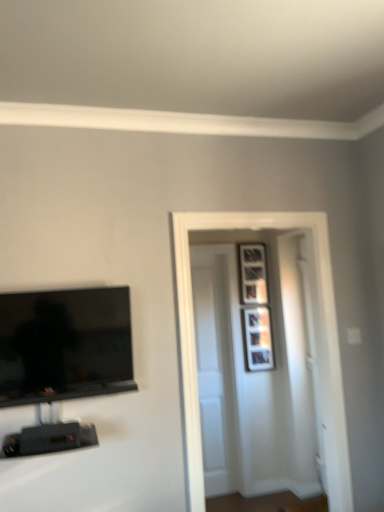
Question: Is black glossy tv at left further to the viewer compared to wooden picture frame at upper right, placed as the first picture frame when sorted from top to bottom?

Choices:
 (A) yes
 (B) no

Answer: (B)

Question: Does black glossy tv at left contain wooden picture frame at upper right, placed as the first picture frame when sorted from top to bottom?

Choices:
 (A) yes
 (B) no

Answer: (B)

Question: Considering the relative sizes of black glossy tv at left and wooden picture frame at upper right, placed as the first picture frame when sorted from top to bottom, in the image provided, is black glossy tv at left bigger than wooden picture frame at upper right, placed as the first picture frame when sorted from top to bottom,?

Choices:
 (A) yes
 (B) no

Answer: (A)

Question: Does black glossy tv at left appear on the right side of wooden picture frame at upper right, placed as the first picture frame when sorted from top to bottom?

Choices:
 (A) yes
 (B) no

Answer: (B)

Question: Can you confirm if black glossy tv at left is thinner than wooden picture frame at upper right, acting as the second picture frame starting from the bottom?

Choices:
 (A) yes
 (B) no

Answer: (B)

Question: Is black glossy tv at left to the left of wooden picture frame at upper right, placed as the first picture frame when sorted from top to bottom, from the viewer's perspective?

Choices:
 (A) yes
 (B) no

Answer: (A)

Question: From a real-world perspective, is white glossy door at center, the first door viewed from the front, located beneath white wooden door at center, marked as the second door in a front-to-back arrangement?

Choices:
 (A) no
 (B) yes

Answer: (A)

Question: From the image's perspective, is white glossy door at center, the first door viewed from the front, above white wooden door at center, marked as the second door in a front-to-back arrangement?

Choices:
 (A) yes
 (B) no

Answer: (A)

Question: Could you tell me if white glossy door at center, arranged as the 2th door when viewed from the back, is facing white wooden door at center, marked as the second door in a front-to-back arrangement?

Choices:
 (A) yes
 (B) no

Answer: (B)

Question: Does white glossy door at center, arranged as the 2th door when viewed from the back, appear on the left side of white wooden door at center, positioned as the first door in back-to-front order?

Choices:
 (A) yes
 (B) no

Answer: (B)

Question: Is white glossy door at center, the first door viewed from the front, placed right next to white wooden door at center, positioned as the first door in back-to-front order?

Choices:
 (A) no
 (B) yes

Answer: (A)

Question: Is white glossy door at center, the first door viewed from the front, at the right side of white wooden door at center, positioned as the first door in back-to-front order?

Choices:
 (A) yes
 (B) no

Answer: (A)

Question: From a real-world perspective, does matte silver picture frame at upper right, marked as the first picture frame in a bottom-to-top arrangement, sit lower than white glossy door at center, the first door viewed from the front?

Choices:
 (A) yes
 (B) no

Answer: (B)